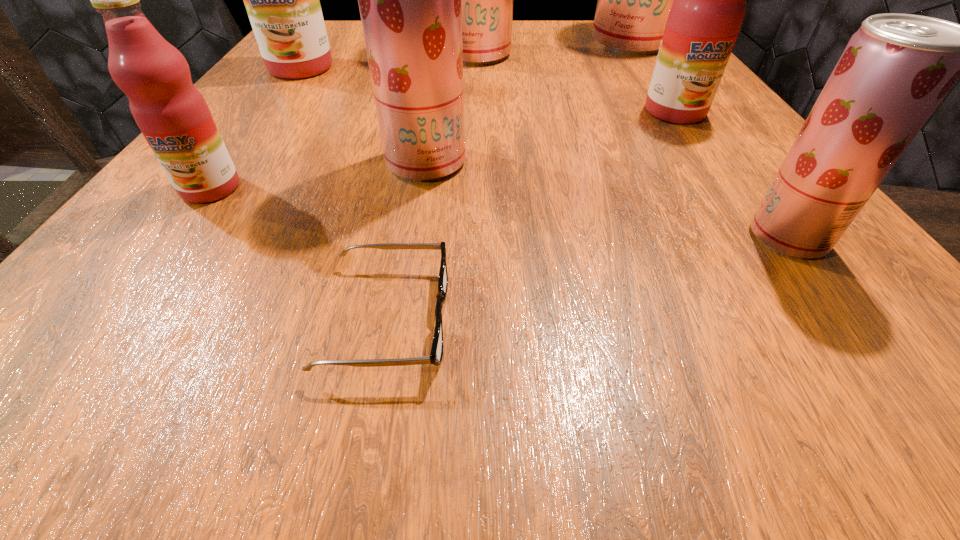
You are a GUI agent. You are given a task and a screenshot of the screen. Output one action in this format:
    pyautogui.click(x=<x>, y=<y>)
    Task: Click on the tallest fruit juice
    
    Given the screenshot: What is the action you would take?
    pyautogui.click(x=634, y=0)

Locate an element on the screen. the biggest strawberry fruit juice is located at coordinates (634, 0).

Where is `the third smallest strawberry fruit juice`? the third smallest strawberry fruit juice is located at coordinates (486, 0).

The height and width of the screenshot is (540, 960). I want to click on the biggest pink fruit juice, so click(x=282, y=0).

What are the coordinates of `the third biggest strawberry fruit juice` in the screenshot? It's located at (410, 0).

This screenshot has width=960, height=540. What are the coordinates of `the second smallest pink fruit juice` in the screenshot? It's located at (709, 6).

Locate an element on the screen. Image resolution: width=960 pixels, height=540 pixels. the fourth nearest fruit juice is located at coordinates (709, 6).

Locate an element on the screen. The width and height of the screenshot is (960, 540). the seventh farthest object is located at coordinates (896, 69).

This screenshot has height=540, width=960. Find the location of `the nearest fruit juice`. the nearest fruit juice is located at coordinates (896, 69).

Where is `the smallest pink fruit juice`? This screenshot has width=960, height=540. the smallest pink fruit juice is located at coordinates (173, 116).